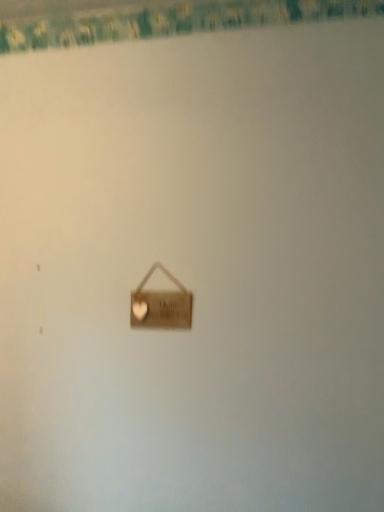
Question: Is wooden sign at center placed right next to green floral fabric at upper center?

Choices:
 (A) no
 (B) yes

Answer: (A)

Question: From a real-world perspective, is wooden sign at center below green floral fabric at upper center?

Choices:
 (A) yes
 (B) no

Answer: (A)

Question: Does wooden sign at center have a greater width compared to green floral fabric at upper center?

Choices:
 (A) no
 (B) yes

Answer: (A)

Question: Is wooden sign at center taller than green floral fabric at upper center?

Choices:
 (A) no
 (B) yes

Answer: (B)

Question: Considering the relative positions of wooden sign at center and green floral fabric at upper center in the image provided, is wooden sign at center to the right of green floral fabric at upper center from the viewer's perspective?

Choices:
 (A) yes
 (B) no

Answer: (B)

Question: Would you consider wooden sign at center to be distant from green floral fabric at upper center?

Choices:
 (A) yes
 (B) no

Answer: (B)

Question: Can you confirm if green floral fabric at upper center is taller than wooden sign at center?

Choices:
 (A) yes
 (B) no

Answer: (B)

Question: Is green floral fabric at upper center smaller than wooden sign at center?

Choices:
 (A) no
 (B) yes

Answer: (A)

Question: Can you confirm if green floral fabric at upper center is shorter than wooden sign at center?

Choices:
 (A) yes
 (B) no

Answer: (A)

Question: Considering the relative sizes of green floral fabric at upper center and wooden sign at center in the image provided, is green floral fabric at upper center bigger than wooden sign at center?

Choices:
 (A) no
 (B) yes

Answer: (B)

Question: Are green floral fabric at upper center and wooden sign at center located far from each other?

Choices:
 (A) yes
 (B) no

Answer: (B)

Question: Can you confirm if green floral fabric at upper center is wider than wooden sign at center?

Choices:
 (A) no
 (B) yes

Answer: (B)

Question: In the image, is green floral fabric at upper center positioned in front of or behind wooden sign at center?

Choices:
 (A) behind
 (B) front

Answer: (B)